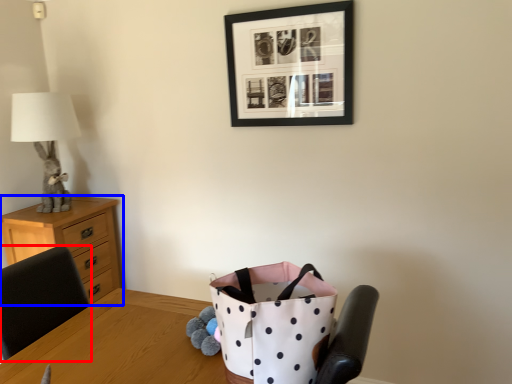
Question: Which object is closer to the camera taking this photo, chair (highlighted by a red box) or chest of drawers (highlighted by a blue box)?

Choices:
 (A) chair
 (B) chest of drawers

Answer: (A)